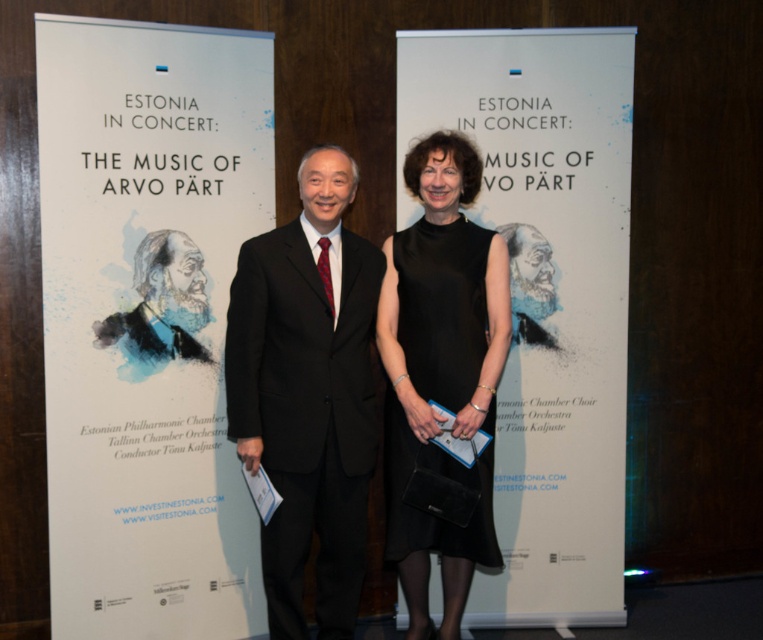
In the scene shown: You are standing in front of the concert event banners and want to read the text on the white paper poster at left. Can you read it clearly without moving closer?

The white paper poster at left is 2.67 meters from the viewer, so yes, you can read it clearly without moving closer.

You are standing in front of the concert banners and see a point marked at coordinates (543, 296). What object is located at that point?

The point at (543, 296) corresponds to the white paper at center.